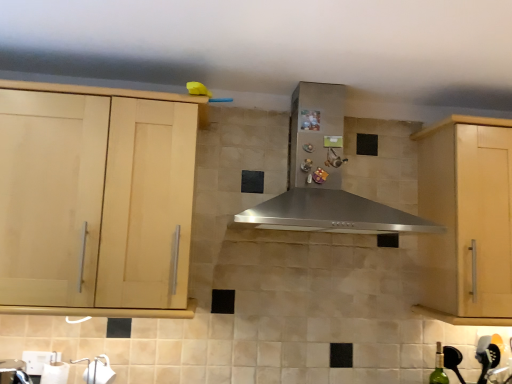
Question: Can you confirm if light wood cabinet at left, arranged as the first cabinetry when viewed from the left, is thinner than green glass bottle at lower right?

Choices:
 (A) no
 (B) yes

Answer: (A)

Question: From the image's perspective, is light wood cabinet at left, arranged as the first cabinetry when viewed from the left, located beneath green glass bottle at lower right?

Choices:
 (A) yes
 (B) no

Answer: (B)

Question: Can you confirm if light wood cabinet at left, arranged as the first cabinetry when viewed from the left, is bigger than green glass bottle at lower right?

Choices:
 (A) no
 (B) yes

Answer: (B)

Question: Is light wood cabinet at left, arranged as the first cabinetry when viewed from the left, outside green glass bottle at lower right?

Choices:
 (A) yes
 (B) no

Answer: (A)

Question: Does light wood cabinet at left, arranged as the first cabinetry when viewed from the left, turn towards green glass bottle at lower right?

Choices:
 (A) yes
 (B) no

Answer: (B)

Question: From the image's perspective, is light wood cabinet at right, which is counted as the 2th cabinetry, starting from the left, located above or below stainless steel range hood at center?

Choices:
 (A) below
 (B) above

Answer: (A)

Question: Based on their positions, is light wood cabinet at right, placed as the first cabinetry when sorted from right to left, located to the left or right of stainless steel range hood at center?

Choices:
 (A) right
 (B) left

Answer: (A)

Question: In terms of width, does light wood cabinet at right, which is counted as the 2th cabinetry, starting from the left, look wider or thinner when compared to stainless steel range hood at center?

Choices:
 (A) wide
 (B) thin

Answer: (B)

Question: From a real-world perspective, is light wood cabinet at right, which is counted as the 2th cabinetry, starting from the left, physically located above or below stainless steel range hood at center?

Choices:
 (A) below
 (B) above

Answer: (A)

Question: From the image's perspective, is green glass bottle at lower right located above or below light wood cabinet at left, arranged as the first cabinetry when viewed from the left?

Choices:
 (A) above
 (B) below

Answer: (B)

Question: From a real-world perspective, is green glass bottle at lower right above or below light wood cabinet at left, which is counted as the 2th cabinetry, starting from the right?

Choices:
 (A) below
 (B) above

Answer: (A)

Question: Is green glass bottle at lower right to the left or to the right of light wood cabinet at left, which is counted as the 2th cabinetry, starting from the right, in the image?

Choices:
 (A) left
 (B) right

Answer: (B)

Question: In terms of height, does green glass bottle at lower right look taller or shorter compared to light wood cabinet at left, arranged as the first cabinetry when viewed from the left?

Choices:
 (A) short
 (B) tall

Answer: (A)

Question: From their relative heights in the image, would you say light wood cabinet at left, arranged as the first cabinetry when viewed from the left, is taller or shorter than green glass bottle at lower right?

Choices:
 (A) short
 (B) tall

Answer: (B)

Question: Looking at their shapes, would you say light wood cabinet at left, arranged as the first cabinetry when viewed from the left, is wider or thinner than green glass bottle at lower right?

Choices:
 (A) wide
 (B) thin

Answer: (A)